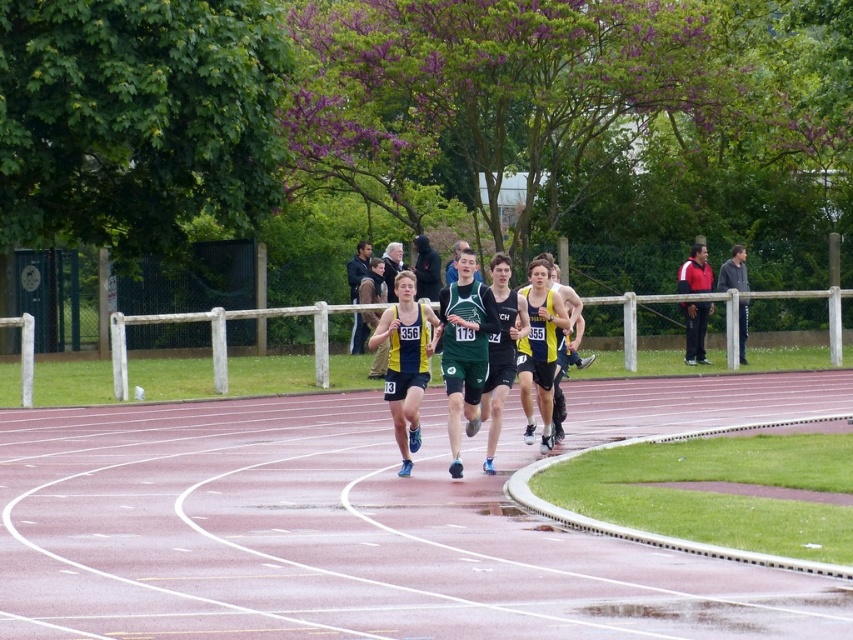
Question: Which point appears closest to the camera in this image?

Choices:
 (A) (724, 600)
 (B) (697, 264)

Answer: (A)

Question: Which point is closer to the camera?

Choices:
 (A) yellow/green jersey at center
 (B) red and white jacket at upper right
 (C) pink rubber track at center

Answer: (C)

Question: Among these objects, which one is farthest from the camera?

Choices:
 (A) yellow/green jersey at center
 (B) pink rubber track at center

Answer: (A)

Question: Is pink rubber track at center above yellow/green jersey at center?

Choices:
 (A) yes
 (B) no

Answer: (B)

Question: Can you confirm if yellow/green jersey at center is positioned below red and white jacket at upper right?

Choices:
 (A) yes
 (B) no

Answer: (A)

Question: Does yellow/green jersey at center have a smaller size compared to yellow and black running suit at center?

Choices:
 (A) yes
 (B) no

Answer: (A)